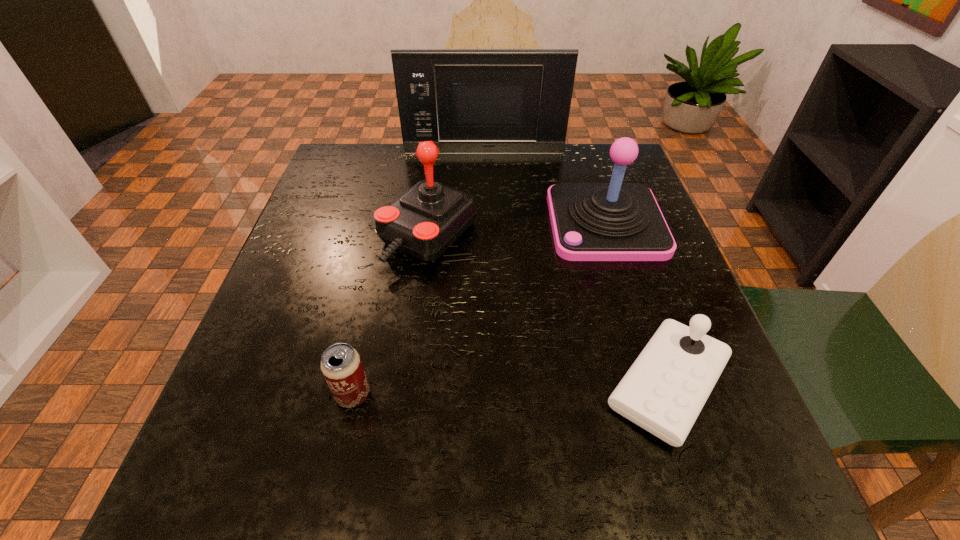
In the image, there is a desktop. Identify the location of vacant space at the near right corner. (768, 483).

The height and width of the screenshot is (540, 960). Find the location of `blank region between the beer can and the nearest joystick`. blank region between the beer can and the nearest joystick is located at coordinates (510, 390).

The width and height of the screenshot is (960, 540). In order to click on vacant area that lies between the tallest object and the beer can in this screenshot , I will do `click(419, 274)`.

You are a GUI agent. You are given a task and a screenshot of the screen. Output one action in this format:
    pyautogui.click(x=<x>, y=<y>)
    Task: Click on the free area in between the shortest joystick and the leftmost joystick
    The image size is (960, 540).
    Given the screenshot: What is the action you would take?
    pyautogui.click(x=548, y=310)

Where is `vacant space that is in between the shortest joystick and the beer can`? The width and height of the screenshot is (960, 540). vacant space that is in between the shortest joystick and the beer can is located at coordinates (510, 390).

Image resolution: width=960 pixels, height=540 pixels. I want to click on object identified as the closest to the farthest object, so click(x=615, y=221).

Choose which object is the second nearest neighbor to the nearest joystick. Please provide its 2D coordinates. Your answer should be formatted as a tuple, i.e. [(x, y)], where the tuple contains the x and y coordinates of a point satisfying the conditions above.

[(426, 220)]

Where is `joystick that is the third closest to the beer can`? This screenshot has height=540, width=960. joystick that is the third closest to the beer can is located at coordinates (615, 221).

The height and width of the screenshot is (540, 960). Identify the location of the second closest joystick to the leftmost joystick. (665, 389).

Identify the location of free region that satisfies the following two spatial constraints: 1. on the front panel of the farthest object; 2. on the left side of the nearest joystick. The image size is (960, 540). (487, 385).